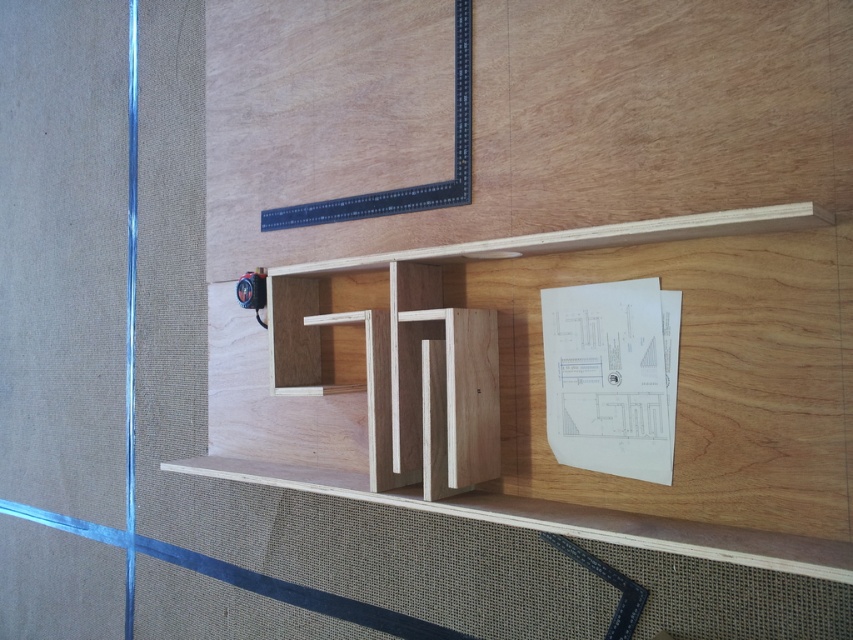
Is natural wood shelf at center closer to camera compared to transparent glass door at left?

Yes.

Is natural wood shelf at center bigger than transparent glass door at left?

Actually, natural wood shelf at center might be smaller than transparent glass door at left.

I want to click on natural wood shelf at center, so click(543, 369).

The height and width of the screenshot is (640, 853). What are the coordinates of `natural wood shelf at center` in the screenshot? It's located at (543, 369).